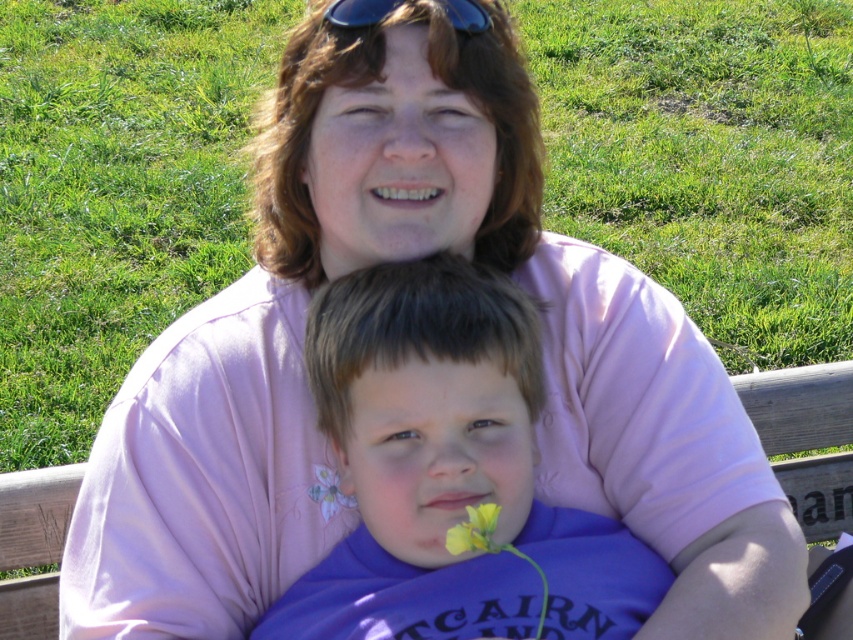
Question: Observing the image, what is the correct spatial positioning of purple fabric at center in reference to blue plastic sunglasses at upper center?

Choices:
 (A) below
 (B) above

Answer: (A)

Question: Is purple fabric at center above yellow matte flower at lower center?

Choices:
 (A) no
 (B) yes

Answer: (B)

Question: Which of the following is the closest to the observer?

Choices:
 (A) yellow matte flower at lower center
 (B) purple fabric at center
 (C) blue plastic sunglasses at upper center

Answer: (A)

Question: Which point is farther from the camera taking this photo?

Choices:
 (A) (311, 486)
 (B) (364, 10)

Answer: (A)

Question: Does purple fabric at center have a larger size compared to yellow matte flower at lower center?

Choices:
 (A) yes
 (B) no

Answer: (A)

Question: Which of the following is the closest to the observer?

Choices:
 (A) yellow matte flower at lower center
 (B) blue plastic sunglasses at upper center

Answer: (A)